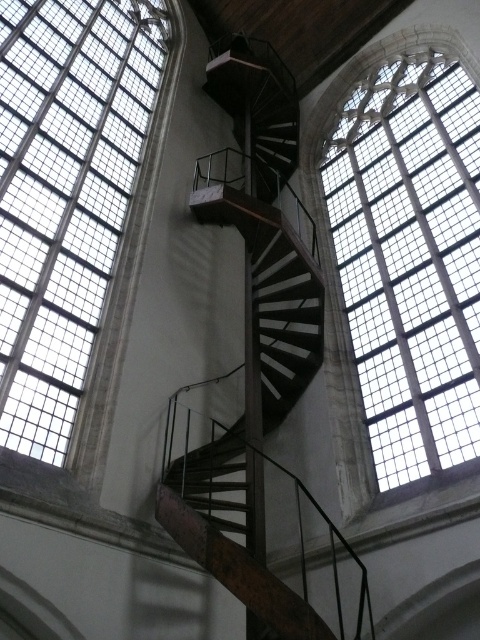
Question: Which object appears farthest from the camera in this image?

Choices:
 (A) clear glass window at upper left
 (B) clear glass window at upper right

Answer: (B)

Question: Which point is closer to the camera taking this photo?

Choices:
 (A) (105, 163)
 (B) (374, 385)

Answer: (B)

Question: Is clear glass window at upper left below clear glass window at upper right?

Choices:
 (A) yes
 (B) no

Answer: (B)

Question: Which point is farther to the camera?

Choices:
 (A) clear glass window at upper left
 (B) clear glass window at upper right

Answer: (B)

Question: Can you confirm if clear glass window at upper left is thinner than clear glass window at upper right?

Choices:
 (A) yes
 (B) no

Answer: (A)

Question: Does clear glass window at upper left appear under clear glass window at upper right?

Choices:
 (A) yes
 (B) no

Answer: (B)